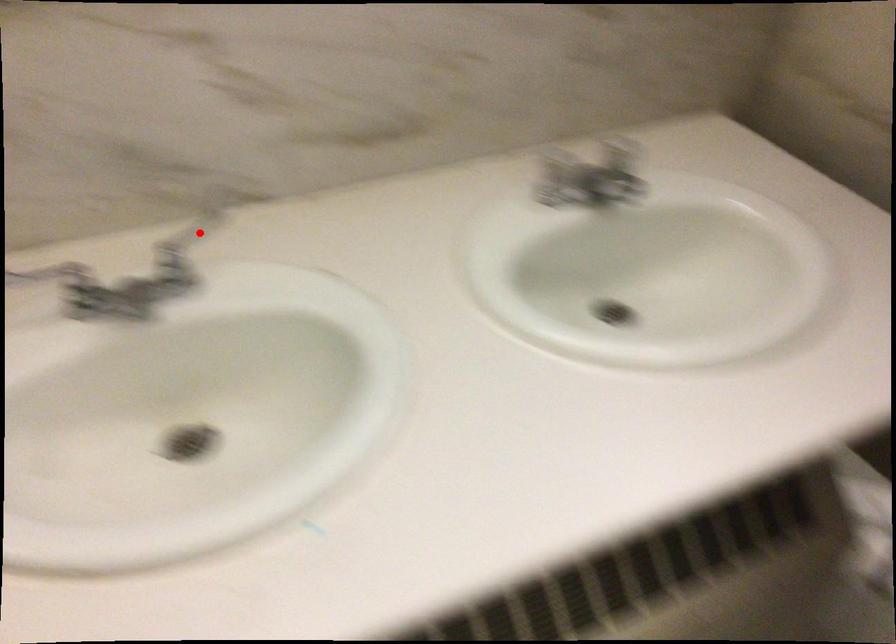
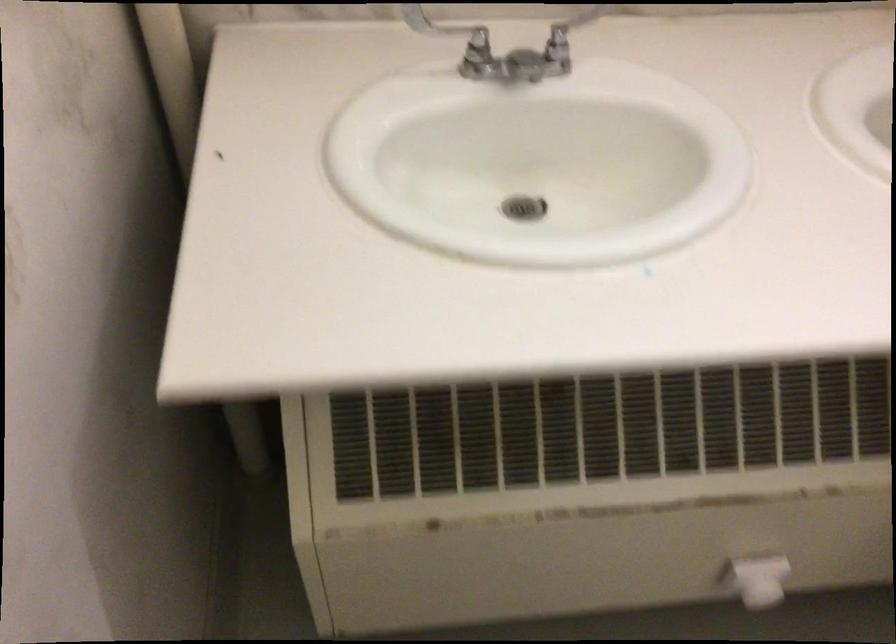
The point at the highlighted location is marked in the first image. Where is the corresponding point in the second image?

(558, 33)